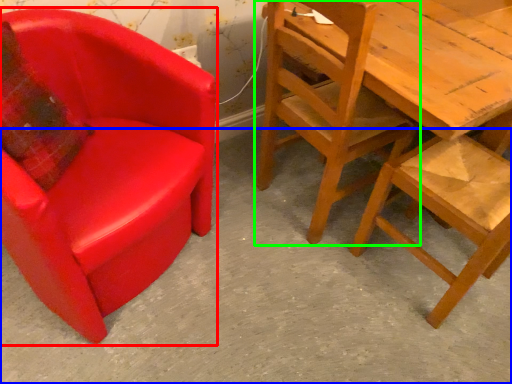
Question: Considering the real-world distances, which object is closest to chair (highlighted by a red box)? concrete (highlighted by a blue box) or chair (highlighted by a green box).

Choices:
 (A) concrete
 (B) chair

Answer: (A)